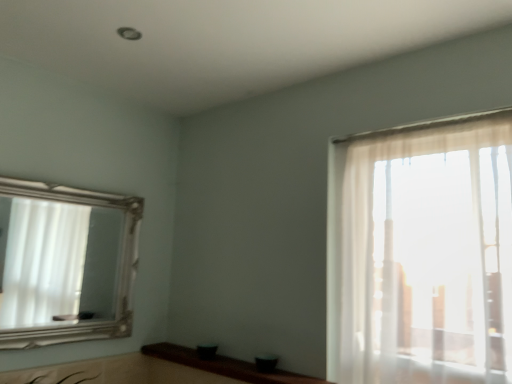
Where is `empty space that is ontop of brown wood counter top at lower center (from a real-world perspective)`? The image size is (512, 384). empty space that is ontop of brown wood counter top at lower center (from a real-world perspective) is located at coordinates (222, 364).